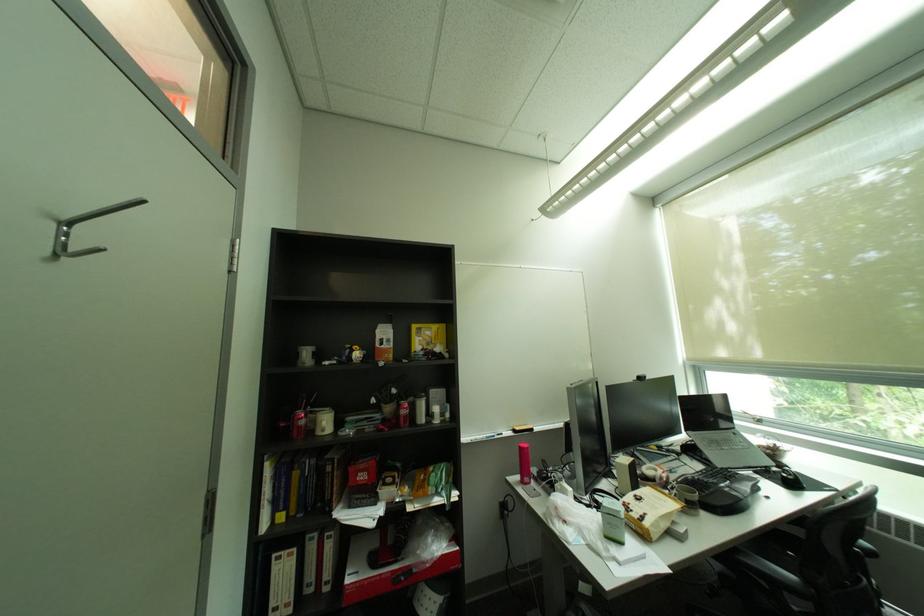
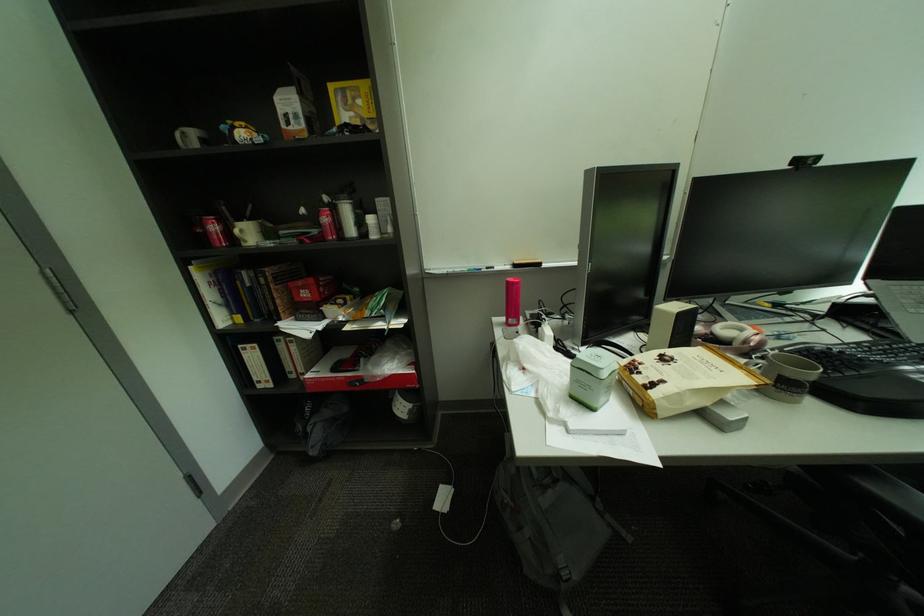
The first image is from the beginning of the video and the second image is from the end. How did the camera likely rotate when shooting the video?

Answer: The camera rotated toward left-down.